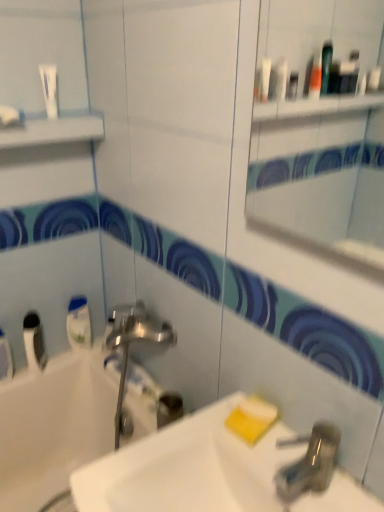
Where is `vacant position to the left of yellow sponge at lower center, which is the 2th soap from top to bottom`? vacant position to the left of yellow sponge at lower center, which is the 2th soap from top to bottom is located at coordinates (198, 431).